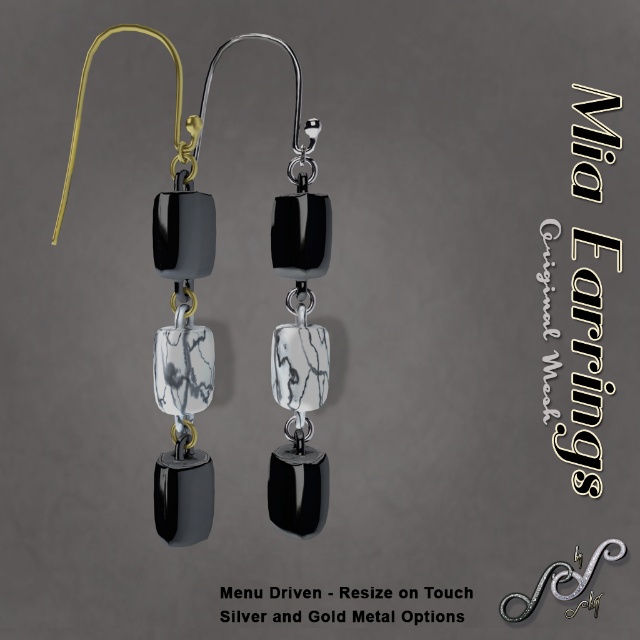
Question: Which point is farther to the camera?

Choices:
 (A) silver metallic hook at upper left
 (B) matte black earrings at center

Answer: (A)

Question: Is matte black earrings at center smaller than silver metallic hook at upper left?

Choices:
 (A) no
 (B) yes

Answer: (A)

Question: Does matte black earrings at center appear over silver metallic hook at upper left?

Choices:
 (A) no
 (B) yes

Answer: (B)

Question: Which point is farther to the camera?

Choices:
 (A) (564, 579)
 (B) (172, 339)

Answer: (A)

Question: Is matte black earrings at center thinner than silver metallic hook at upper left?

Choices:
 (A) yes
 (B) no

Answer: (B)